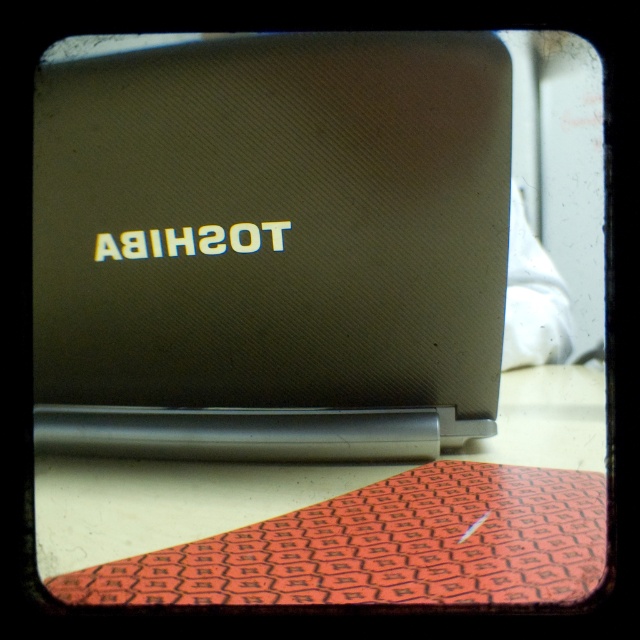
Describe the element at coordinates (272, 246) in the screenshot. I see `satin black laptop at center` at that location.

Which of these two, satin black laptop at center or orange hexagonal patterned mat at lower center, stands taller?

satin black laptop at center

Locate an element on the screen. satin black laptop at center is located at coordinates (272, 246).

Find the location of a particular element. The height and width of the screenshot is (640, 640). satin black laptop at center is located at coordinates (272, 246).